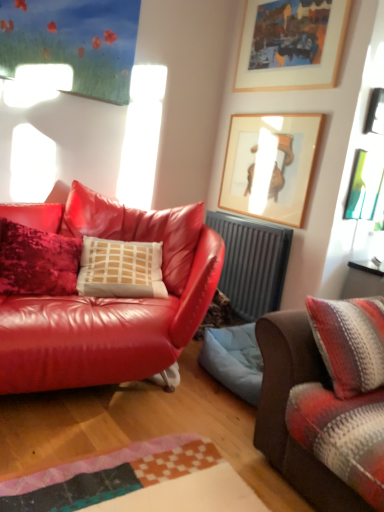
What do you see at coordinates (252, 263) in the screenshot? I see `gray metallic radiator at center` at bounding box center [252, 263].

What do you see at coordinates (285, 408) in the screenshot? I see `striped woolen blanket at right, arranged as the 2th studio couch when viewed from the left` at bounding box center [285, 408].

Describe the element at coordinates (108, 300) in the screenshot. I see `shiny leather couch at left, arranged as the 2th studio couch when viewed from the right` at that location.

Identify the location of metallic silver frame at upper right, which is counted as the fourth picture frame, starting from the top. The height and width of the screenshot is (512, 384). (364, 185).

The image size is (384, 512). What do you see at coordinates (270, 165) in the screenshot? I see `wooden framed artwork at upper center, acting as the third picture frame starting from the top` at bounding box center [270, 165].

At what (x,y) coordinates should I click in order to perform the action: click on gray metallic radiator at center. Please return your answer as a coordinate pair (x, y). This screenshot has width=384, height=512. Looking at the image, I should click on (252, 263).

Is striped woolen blanket at right, arranged as the 2th studio couch when viewed from the left, oriented away from metallic silver frame at upper right, which is counted as the fourth picture frame, starting from the top?

No, striped woolen blanket at right, arranged as the 2th studio couch when viewed from the left,'s orientation is not away from metallic silver frame at upper right, which is counted as the fourth picture frame, starting from the top.

Does striped woolen blanket at right, the first studio couch positioned from the right, appear on the left side of metallic silver frame at upper right, which is counted as the fourth picture frame, starting from the top?

Correct, you'll find striped woolen blanket at right, the first studio couch positioned from the right, to the left of metallic silver frame at upper right, which is counted as the fourth picture frame, starting from the top.

From a real-world perspective, is striped woolen blanket at right, arranged as the 2th studio couch when viewed from the left, above or below metallic silver frame at upper right, the 1th picture frame positioned from the bottom?

striped woolen blanket at right, arranged as the 2th studio couch when viewed from the left, is situated lower than metallic silver frame at upper right, the 1th picture frame positioned from the bottom, in the real world.

From the image's perspective, is striped woolen blanket at right, the first studio couch positioned from the right, under metallic silver frame at upper right, the 1th picture frame positioned from the bottom?

Yes, from the image's perspective, striped woolen blanket at right, the first studio couch positioned from the right, is beneath metallic silver frame at upper right, the 1th picture frame positioned from the bottom.

Considering the positions of objects wooden picture frame at upper center, arranged as the 4th picture frame when ordered from the bottom, and shiny leather couch at left, the 1th studio couch from the left, in the image provided, who is behind, wooden picture frame at upper center, arranged as the 4th picture frame when ordered from the bottom, or shiny leather couch at left, the 1th studio couch from the left,?

wooden picture frame at upper center, arranged as the 4th picture frame when ordered from the bottom, is behind.

Does wooden picture frame at upper center, arranged as the 4th picture frame when ordered from the bottom, have a greater height compared to shiny leather couch at left, arranged as the 2th studio couch when viewed from the right?

Incorrect, the height of wooden picture frame at upper center, arranged as the 4th picture frame when ordered from the bottom, is not larger of that of shiny leather couch at left, arranged as the 2th studio couch when viewed from the right.

From the image's perspective, is wooden picture frame at upper center, the first picture frame from the top, located above shiny leather couch at left, the 1th studio couch from the left?

Yes, from the image's perspective, wooden picture frame at upper center, the first picture frame from the top, is on top of shiny leather couch at left, the 1th studio couch from the left.

Could you measure the distance between wooden picture frame at upper center, arranged as the 4th picture frame when ordered from the bottom, and shiny leather couch at left, the 1th studio couch from the left?

wooden picture frame at upper center, arranged as the 4th picture frame when ordered from the bottom, is 4.73 feet from shiny leather couch at left, the 1th studio couch from the left.

From the image's perspective, between wooden picture frame at upper center, the first picture frame from the top, and wooden framed artwork at upper center, the second picture frame when ordered from bottom to top, who is located below?

From the image's view, wooden framed artwork at upper center, the second picture frame when ordered from bottom to top, is below.

Does point (303, 53) appear closer or farther from the camera than point (294, 155)?

Point (303, 53) is positioned closer to the camera compared to point (294, 155).

Could you tell me if wooden picture frame at upper center, the first picture frame from the top, is facing wooden framed artwork at upper center, acting as the third picture frame starting from the top?

No, wooden picture frame at upper center, the first picture frame from the top, is not facing towards wooden framed artwork at upper center, acting as the third picture frame starting from the top.

Does wooden picture frame at upper center, the first picture frame from the top, touch wooden framed artwork at upper center, acting as the third picture frame starting from the top?

No, wooden picture frame at upper center, the first picture frame from the top, is not in contact with wooden framed artwork at upper center, acting as the third picture frame starting from the top.

Could metallic silver frame at upper right, the 1th picture frame positioned from the bottom, be considered to be inside wooden picture frame at upper center, arranged as the 4th picture frame when ordered from the bottom?

No.

Visually, is wooden picture frame at upper center, arranged as the 4th picture frame when ordered from the bottom, positioned to the left or to the right of metallic silver frame at upper right, the 1th picture frame positioned from the bottom?

wooden picture frame at upper center, arranged as the 4th picture frame when ordered from the bottom, is to the left of metallic silver frame at upper right, the 1th picture frame positioned from the bottom.

Where is `the 3rd picture frame positioned below the wooden picture frame at upper center, the first picture frame from the top (from a real-world perspective)`? the 3rd picture frame positioned below the wooden picture frame at upper center, the first picture frame from the top (from a real-world perspective) is located at coordinates (364, 185).

Is gray metallic radiator at center positioned far away from striped woolen blanket at right, the first studio couch positioned from the right?

Yes.

In the scene shown: Is gray metallic radiator at center smaller than striped woolen blanket at right, arranged as the 2th studio couch when viewed from the left?

Correct, gray metallic radiator at center occupies less space than striped woolen blanket at right, arranged as the 2th studio couch when viewed from the left.

Is gray metallic radiator at center wider or thinner than striped woolen blanket at right, the first studio couch positioned from the right?

In the image, gray metallic radiator at center appears to be more narrow than striped woolen blanket at right, the first studio couch positioned from the right.

Can we say gray metallic radiator at center lies outside striped woolen blanket at right, arranged as the 2th studio couch when viewed from the left?

gray metallic radiator at center is positioned outside striped woolen blanket at right, arranged as the 2th studio couch when viewed from the left.

From a real-world perspective, which object stands above the other?

wooden framed artwork at upper center, acting as the third picture frame starting from the top, from a real-world perspective.

Which is behind, point (314, 505) or point (299, 130)?

Positioned behind is point (299, 130).

Locate an element on the screen. This screenshot has width=384, height=512. studio couch that is the 1st one below the wooden framed artwork at upper center, acting as the third picture frame starting from the top (from a real-world perspective) is located at coordinates (285, 408).

Is striped woolen blanket at right, arranged as the 2th studio couch when viewed from the left, not inside wooden framed artwork at upper center, the second picture frame when ordered from bottom to top?

Indeed, striped woolen blanket at right, arranged as the 2th studio couch when viewed from the left, is completely outside wooden framed artwork at upper center, the second picture frame when ordered from bottom to top.

Considering the sizes of objects wooden picture frame at upper center, arranged as the 4th picture frame when ordered from the bottom, and metallic silver picture frame at upper right, acting as the second picture frame starting from the top, in the image provided, who is bigger, wooden picture frame at upper center, arranged as the 4th picture frame when ordered from the bottom, or metallic silver picture frame at upper right, acting as the second picture frame starting from the top,?

With larger size is wooden picture frame at upper center, arranged as the 4th picture frame when ordered from the bottom.

Can you tell me how much wooden picture frame at upper center, arranged as the 4th picture frame when ordered from the bottom, and metallic silver picture frame at upper right, the 3th picture frame when ordered from bottom to top, differ in facing direction?

89.7 degrees separate the facing orientations of wooden picture frame at upper center, arranged as the 4th picture frame when ordered from the bottom, and metallic silver picture frame at upper right, the 3th picture frame when ordered from bottom to top.

Which is farther from the camera, (281, 26) or (371, 116)?

The point (281, 26) is farther from the camera.

Are wooden picture frame at upper center, the first picture frame from the top, and metallic silver picture frame at upper right, acting as the second picture frame starting from the top, far apart?

They are positioned close to each other.

The image size is (384, 512). I want to click on the 2nd studio couch positioned below the metallic silver frame at upper right, which is counted as the fourth picture frame, starting from the top (from the image's perspective), so click(x=285, y=408).

Which picture frame is the 1st one when counting from the back of the shiny leather couch at left, arranged as the 2th studio couch when viewed from the right? Please provide its 2D coordinates.

[(291, 44)]

Based on their spatial positions, is metallic silver picture frame at upper right, acting as the second picture frame starting from the top, or metallic silver frame at upper right, the 1th picture frame positioned from the bottom, further from shiny leather couch at left, arranged as the 2th studio couch when viewed from the right?

Based on the image, metallic silver picture frame at upper right, acting as the second picture frame starting from the top, appears to be further to shiny leather couch at left, arranged as the 2th studio couch when viewed from the right.

From the picture: When comparing their distances from metallic silver picture frame at upper right, acting as the second picture frame starting from the top, does wooden picture frame at upper center, arranged as the 4th picture frame when ordered from the bottom, or striped woolen blanket at right, the first studio couch positioned from the right, seem further?

Based on the image, striped woolen blanket at right, the first studio couch positioned from the right, appears to be further to metallic silver picture frame at upper right, acting as the second picture frame starting from the top.

Considering their positions, is wooden framed artwork at upper center, the second picture frame when ordered from bottom to top, positioned closer to wooden picture frame at upper center, arranged as the 4th picture frame when ordered from the bottom, than metallic silver frame at upper right, the 1th picture frame positioned from the bottom?

wooden framed artwork at upper center, the second picture frame when ordered from bottom to top.

From the image, which object appears to be farther from gray metallic radiator at center, metallic silver frame at upper right, the 1th picture frame positioned from the bottom, or metallic silver picture frame at upper right, acting as the second picture frame starting from the top?

Among the two, metallic silver picture frame at upper right, acting as the second picture frame starting from the top, is located further to gray metallic radiator at center.

From the image, which object appears to be farther from gray metallic radiator at center, shiny leather couch at left, arranged as the 2th studio couch when viewed from the right, or metallic silver picture frame at upper right, the 3th picture frame when ordered from bottom to top?

metallic silver picture frame at upper right, the 3th picture frame when ordered from bottom to top, is positioned further to the anchor gray metallic radiator at center.

Which object lies further to the anchor point striped woolen blanket at right, the first studio couch positioned from the right, wooden picture frame at upper center, arranged as the 4th picture frame when ordered from the bottom, or metallic silver picture frame at upper right, the 3th picture frame when ordered from bottom to top?

The object further to striped woolen blanket at right, the first studio couch positioned from the right, is wooden picture frame at upper center, arranged as the 4th picture frame when ordered from the bottom.

Considering their positions, is shiny leather couch at left, arranged as the 2th studio couch when viewed from the right, positioned closer to striped woolen blanket at right, the first studio couch positioned from the right, than gray metallic radiator at center?

Based on the image, shiny leather couch at left, arranged as the 2th studio couch when viewed from the right, appears to be nearer to striped woolen blanket at right, the first studio couch positioned from the right.

Considering their positions, is metallic silver picture frame at upper right, the 3th picture frame when ordered from bottom to top, positioned closer to metallic silver frame at upper right, the 1th picture frame positioned from the bottom, than gray metallic radiator at center?

metallic silver picture frame at upper right, the 3th picture frame when ordered from bottom to top, lies closer to metallic silver frame at upper right, the 1th picture frame positioned from the bottom, than the other object.

You are a GUI agent. You are given a task and a screenshot of the screen. Output one action in this format:
    pyautogui.click(x=<x>, y=<y>)
    Task: Click on the studio couch located between striped woolen blanket at right, the first studio couch positioned from the right, and wooden framed artwork at upper center, the second picture frame when ordered from bottom to top, in the depth direction
    The image size is (384, 512).
    Given the screenshot: What is the action you would take?
    pyautogui.click(x=108, y=300)

Identify the location of studio couch between shiny leather couch at left, the 1th studio couch from the left, and metallic silver frame at upper right, the 1th picture frame positioned from the bottom, in the horizontal direction. This screenshot has width=384, height=512. (285, 408).

In order to click on radiator between wooden picture frame at upper center, arranged as the 4th picture frame when ordered from the bottom, and shiny leather couch at left, arranged as the 2th studio couch when viewed from the right, vertically in this screenshot , I will do `click(252, 263)`.

Identify the location of picture frame between wooden picture frame at upper center, arranged as the 4th picture frame when ordered from the bottom, and wooden framed artwork at upper center, the second picture frame when ordered from bottom to top, in the up-down direction. The height and width of the screenshot is (512, 384). (375, 113).